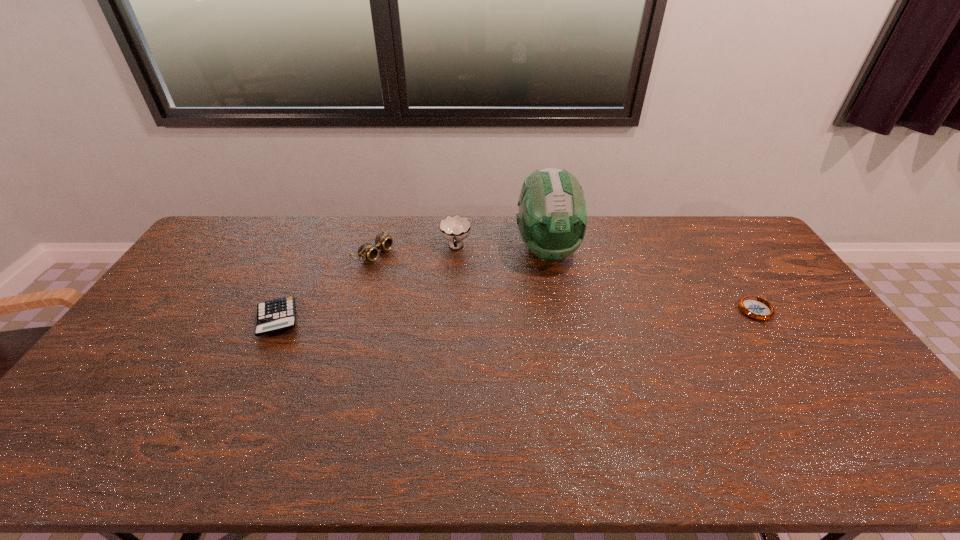
Locate an element on the screen. vacant space located 0.340m on the side of the fourth shortest object with the handle is located at coordinates (456, 333).

The image size is (960, 540). What are the coordinates of `football helmet located at the far edge` in the screenshot? It's located at (552, 219).

Image resolution: width=960 pixels, height=540 pixels. I want to click on goggles at the far edge, so click(x=366, y=251).

Find the location of a particular element. The width and height of the screenshot is (960, 540). cup that is at the far edge is located at coordinates (455, 228).

Identify the location of object that is positioned at the right edge. The image size is (960, 540). (754, 307).

I want to click on vacant space at the far edge of the desktop, so click(x=596, y=239).

The width and height of the screenshot is (960, 540). In the image, there is a desktop. Identify the location of vacant space at the near edge. (324, 408).

Where is `free spot at the left edge of the desktop`? This screenshot has height=540, width=960. free spot at the left edge of the desktop is located at coordinates (227, 267).

In order to click on blank area at the right edge in this screenshot , I will do `click(824, 333)`.

In the image, there is a desktop. At what (x,y) coordinates should I click in order to perform the action: click on blank space at the near right corner. Please return your answer as a coordinate pair (x, y). This screenshot has width=960, height=540. Looking at the image, I should click on (876, 408).